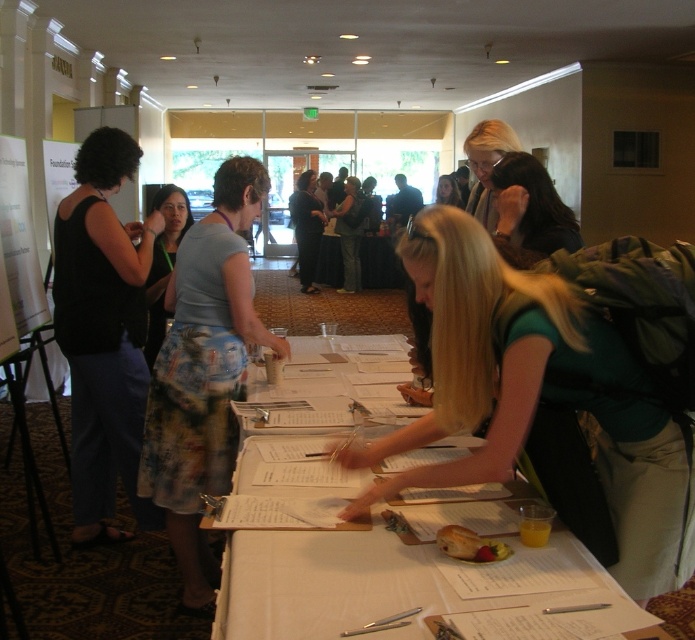
Question: Is green fabric backpack at center to the left of floral skirt at center from the viewer's perspective?

Choices:
 (A) no
 (B) yes

Answer: (A)

Question: Estimate the real-world distances between objects in this image. Which object is closer to the blonde hair at center?

Choices:
 (A) white paper at center
 (B) floral skirt at center
 (C) green fabric backpack at center
 (D) black fabric tank top at left

Answer: (D)

Question: Which point is farther to the camera?

Choices:
 (A) (553, 307)
 (B) (329, 632)

Answer: (A)

Question: Does floral skirt at center have a smaller size compared to matte gray shirt at center?

Choices:
 (A) yes
 (B) no

Answer: (A)

Question: Based on their relative distances, which object is nearer to the floral skirt at center?

Choices:
 (A) golden brown bread at table center
 (B) white paper at center
 (C) matte blue shirt at center

Answer: (C)

Question: From the image, what is the correct spatial relationship of black fabric tank top at left in relation to blonde hair at center?

Choices:
 (A) above
 (B) below

Answer: (B)